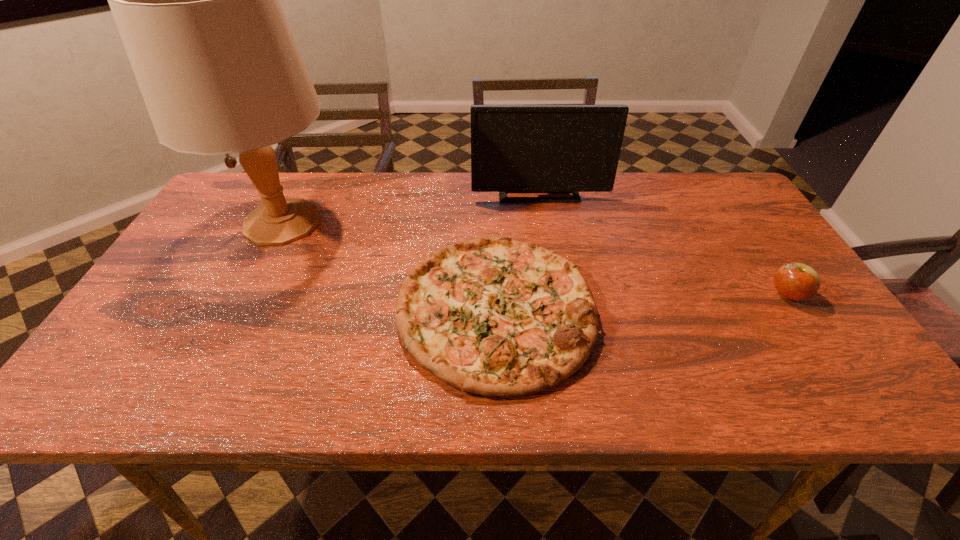
This screenshot has height=540, width=960. What are the coordinates of `blank area at the near left corner` in the screenshot? It's located at (174, 368).

The height and width of the screenshot is (540, 960). In order to click on blank area at the far right corner in this screenshot , I will do `click(725, 196)`.

Identify the location of free space between the shortest object and the table lamp. 389,266.

Find the location of `empty space between the apple and the shortest object`. empty space between the apple and the shortest object is located at coordinates (641, 302).

I want to click on vacant point located between the shortest object and the tallest object, so click(389, 266).

You are a GUI agent. You are given a task and a screenshot of the screen. Output one action in this format:
    pyautogui.click(x=<x>, y=<y>)
    Task: Click on the vacant area that lies between the computer monitor and the rightmost object
    Image resolution: width=960 pixels, height=540 pixels.
    Given the screenshot: What is the action you would take?
    pyautogui.click(x=663, y=242)

Find the location of `free space between the table lamp and the third shortest object`. free space between the table lamp and the third shortest object is located at coordinates (411, 206).

At what (x,y) coordinates should I click in order to perform the action: click on unoccupied position between the table lamp and the pizza. Please return your answer as a coordinate pair (x, y). The image size is (960, 540). Looking at the image, I should click on (389, 266).

You are a GUI agent. You are given a task and a screenshot of the screen. Output one action in this format:
    pyautogui.click(x=<x>, y=<y>)
    Task: Click on the object that stands as the second closest to the third shortest object
    
    Given the screenshot: What is the action you would take?
    pyautogui.click(x=196, y=1)

Point out which object is positioned as the nearest to the apple. Please provide its 2D coordinates. Your answer should be formatted as a tuple, i.e. [(x, y)], where the tuple contains the x and y coordinates of a point satisfying the conditions above.

[(493, 316)]